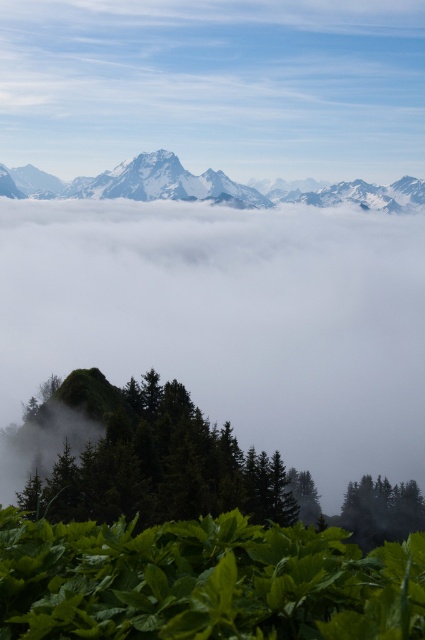
Question: In this image, where is green matte tree at center located relative to snowy granite mountain range at upper center?

Choices:
 (A) right
 (B) left

Answer: (B)

Question: Which point appears farthest from the camera in this image?

Choices:
 (A) (25, 177)
 (B) (234, 616)
 (C) (384, 540)

Answer: (A)

Question: Estimate the real-world distances between objects in this image. Which object is closer to the white fluffy cloud at center?

Choices:
 (A) green leafy plant at lower center
 (B) green matte tree at lower right

Answer: (B)

Question: Which point is closer to the camera?

Choices:
 (A) 84,608
 (B) 269,188
 (C) 45,408

Answer: (A)

Question: Is green leafy plant at lower center positioned behind snowy granite mountain range at upper center?

Choices:
 (A) yes
 (B) no

Answer: (B)

Question: From the image, what is the correct spatial relationship of white fluffy cloud at center in relation to snowy granite mountain range at upper center?

Choices:
 (A) below
 (B) above

Answer: (A)